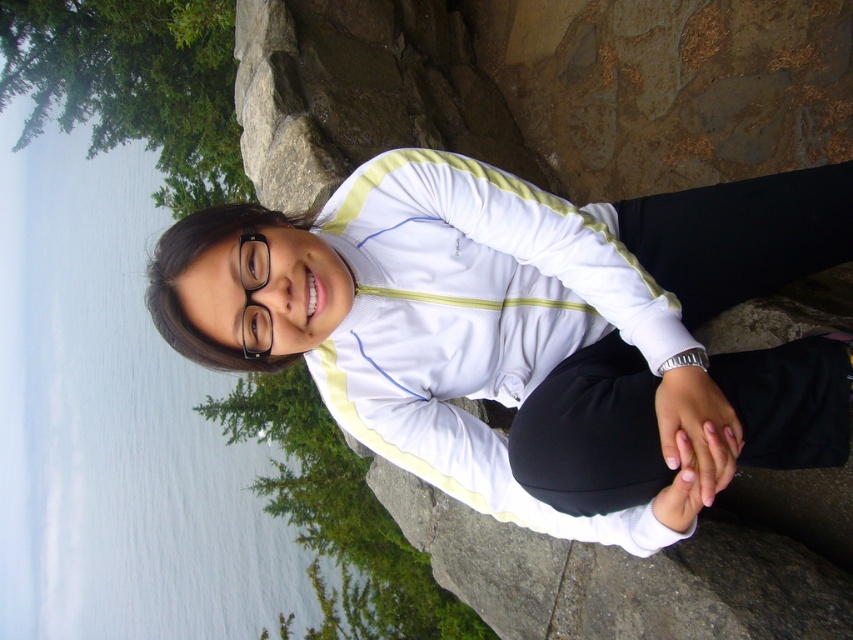
Who is taller, transparent plastic glasses at center or silver metallic bracelet at lower center?

Standing taller between the two is transparent plastic glasses at center.

Is transparent plastic glasses at center in front of silver metallic bracelet at lower center?

No, transparent plastic glasses at center is further to the viewer.

Who is more distant from viewer, (271, 337) or (672, 364)?

Point (271, 337)

You are a GUI agent. You are given a task and a screenshot of the screen. Output one action in this format:
    pyautogui.click(x=<x>, y=<y>)
    Task: Click on the transparent plastic glasses at center
    The height and width of the screenshot is (640, 853).
    Given the screenshot: What is the action you would take?
    pyautogui.click(x=253, y=291)

Find the location of `white smooth jacket at center`. white smooth jacket at center is located at coordinates (534, 332).

Is white smooth jacket at center to the right of silver metallic bracelet at lower center from the viewer's perspective?

No, white smooth jacket at center is not to the right of silver metallic bracelet at lower center.

Measure the distance between point (695, 268) and camera.

Point (695, 268) is 1.69 meters away from camera.

Find the location of a particular element. The height and width of the screenshot is (640, 853). white smooth jacket at center is located at coordinates (534, 332).

Does point (416, 193) lie in front of point (241, 275)?

No.

What do you see at coordinates (534, 332) in the screenshot? I see `white smooth jacket at center` at bounding box center [534, 332].

Identify the location of white smooth jacket at center. This screenshot has height=640, width=853. click(534, 332).